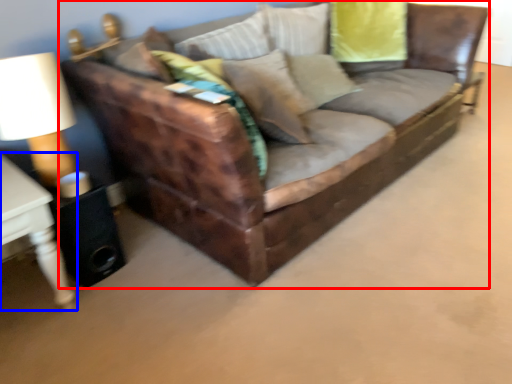
Question: Which object appears closest to the camera in this image, studio couch (highlighted by a red box) or table (highlighted by a blue box)?

Choices:
 (A) studio couch
 (B) table

Answer: (A)